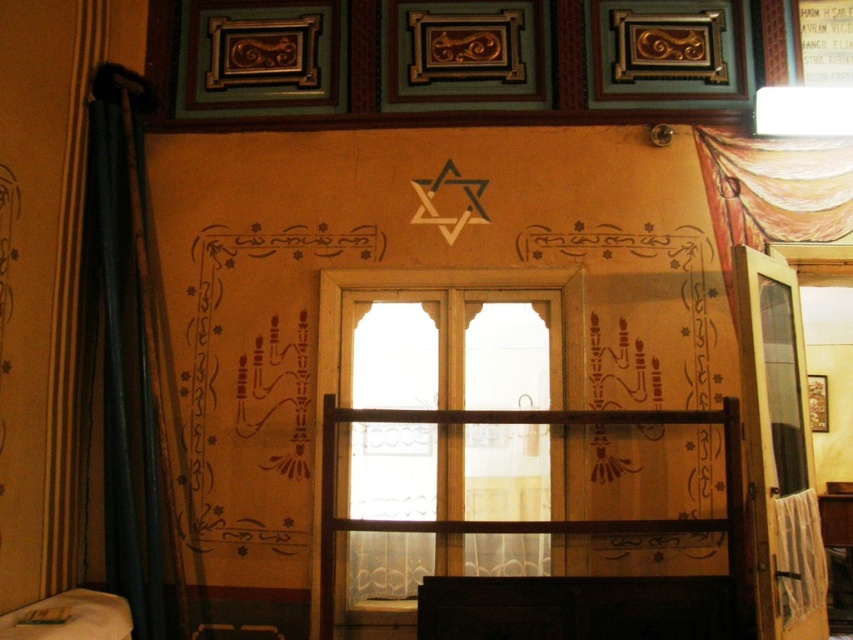
Can you confirm if wooden at center is positioned below translucent fabric curtain at upper right?

Correct, wooden at center is located below translucent fabric curtain at upper right.

Which of these two, wooden at center or translucent fabric curtain at upper right, stands taller?

With more height is wooden at center.

Does point (329, 513) come closer to viewer compared to point (793, 173)?

Yes, it is in front of point (793, 173).

I want to click on wooden at center, so click(x=534, y=520).

From the picture: Does wooden window at center have a greater width compared to translucent fabric curtain at upper right?

Yes.

Between point (560, 502) and point (824, 163), which one is positioned behind?

The point (824, 163) is behind.

Which is in front, point (534, 442) or point (721, 163)?

Point (534, 442)

Where is `wooden window at center`? Image resolution: width=853 pixels, height=640 pixels. wooden window at center is located at coordinates (456, 346).

Which is behind, point (741, 490) or point (90, 624)?

Positioned behind is point (741, 490).

Who is more forward, (534,419) or (0,636)?

Point (0,636)

This screenshot has height=640, width=853. Identify the location of wooden at center. (534, 520).